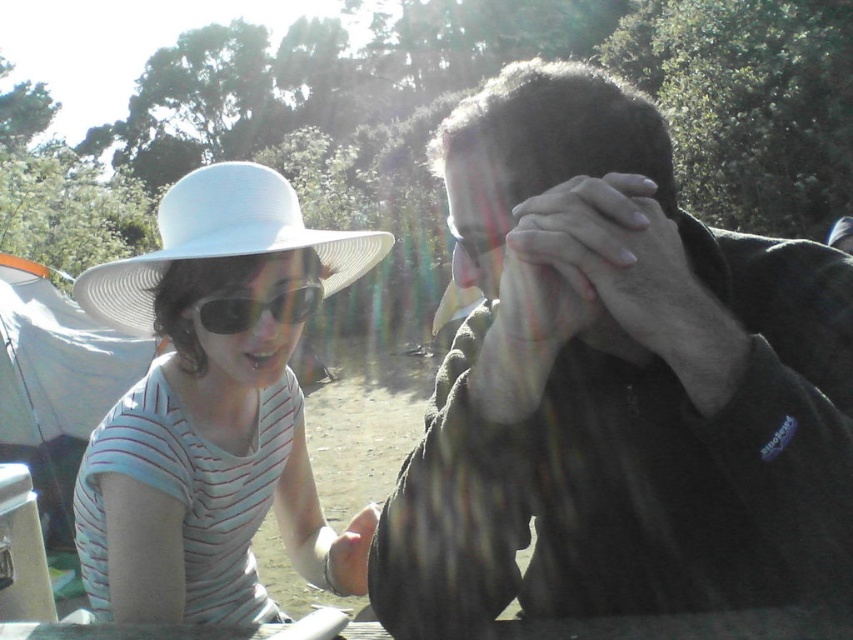
You are a photographer trying to capture a candid shot of both the white matte hat at left and the matte black face at center. Given that your camera has a minimum focus distance of 50 centimeters, will you be able to capture both subjects clearly in the same frame without moving either of them?

The white matte hat at left and the matte black face at center are 46.80 centimeters apart. Since the distance between them is less than the camera minimum focus distance of 50 centimeters, you will not be able to capture both subjects clearly in the same frame without moving them closer together.

You are a photographer at a park and see two people wearing hats. You have a camera that can only focus on the larger of the two hats. Which hat should you focus on between the white matte hat at left and the white woven hat at left?

The white matte hat at left is bigger than the white woven hat at left, so you should focus on the white matte hat at left.

You are standing in a sunny park and see two hats on the left side of two people. The hats are a white matte hat at left and a white woven hat at left. Which hat is positioned further to the left?

The white matte hat at left is positioned further to the left compared to the white woven hat at left.